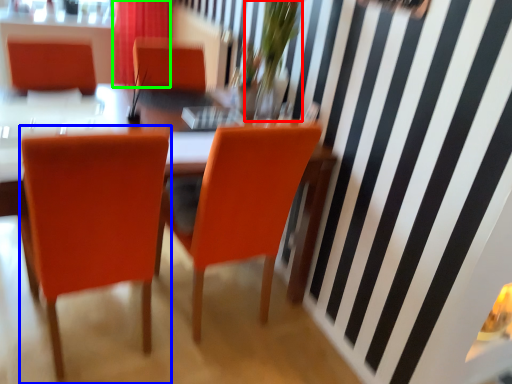
Question: Estimate the real-world distances between objects in this image. Which object is farther from floral arrangement (highlighted by a red box), chair (highlighted by a blue box) or curtain (highlighted by a green box)?

Choices:
 (A) chair
 (B) curtain

Answer: (B)